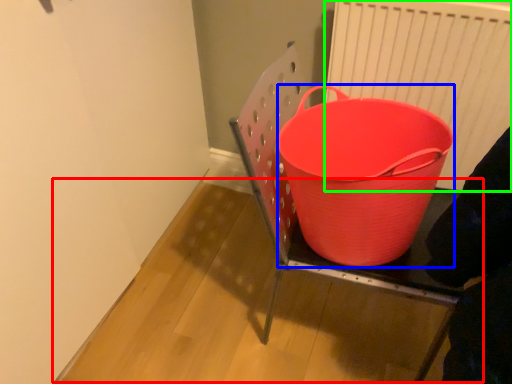
Question: Considering the real-world distances, which object is farthest from table (highlighted by a red box)? basket (highlighted by a blue box) or radiator (highlighted by a green box)?

Choices:
 (A) basket
 (B) radiator

Answer: (B)